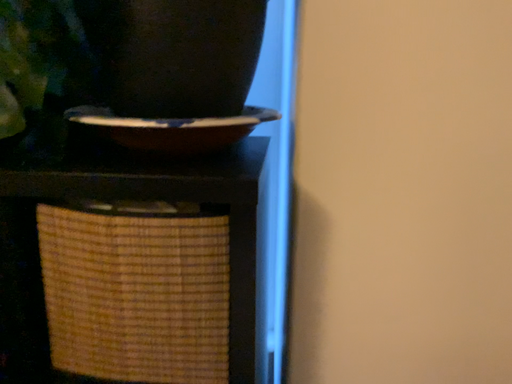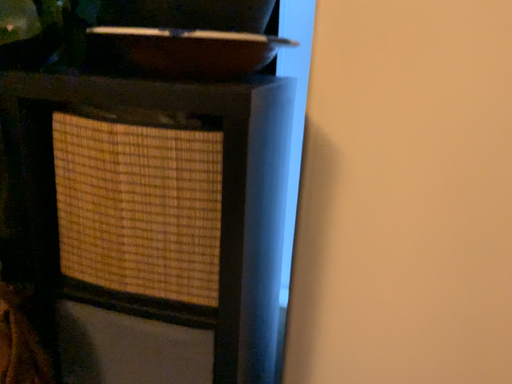
Question: How did the camera likely rotate when shooting the video?

Choices:
 (A) rotated left
 (B) rotated right

Answer: (A)